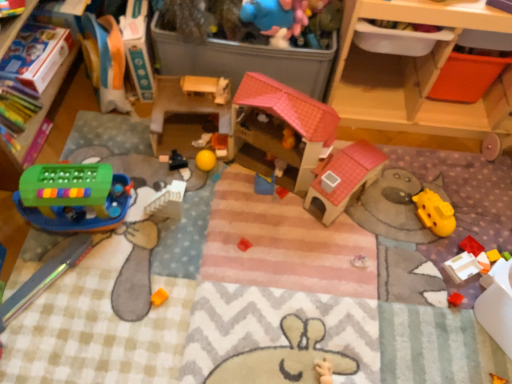
Locate an element on the screen. vacant region to the right of yellow plastic spoon at center, marked as the 3th toy in a right-to-left arrangement is located at coordinates (300, 203).